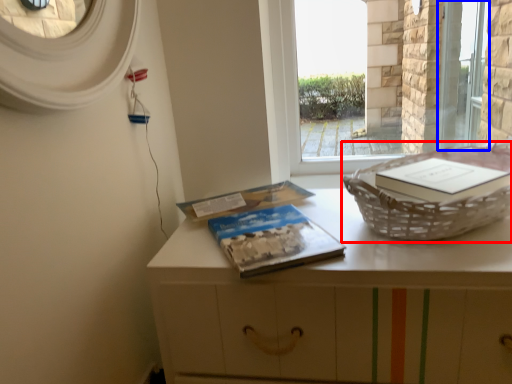
Question: Which of the following is the closest to the observer, basket container (highlighted by a red box) or screen door (highlighted by a blue box)?

Choices:
 (A) basket container
 (B) screen door

Answer: (A)